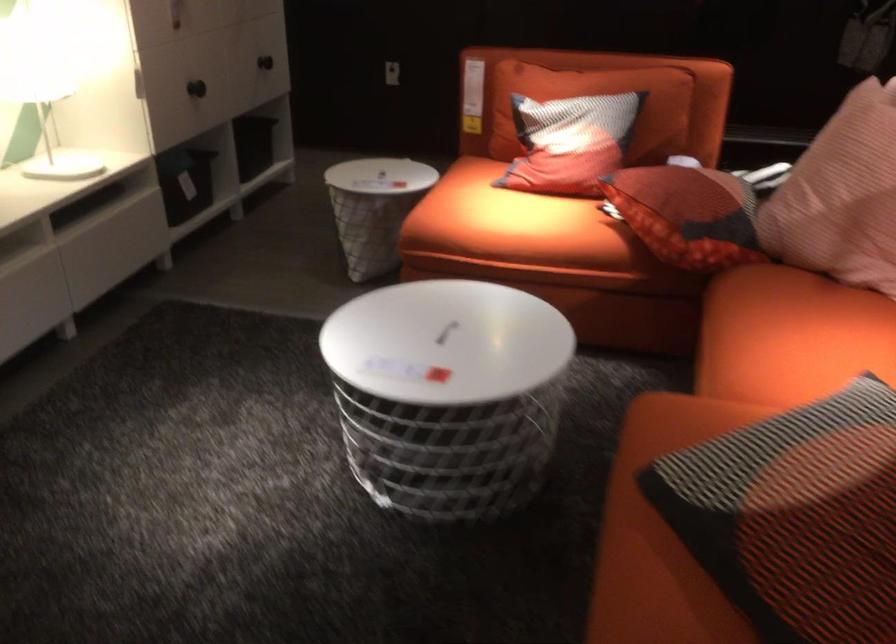
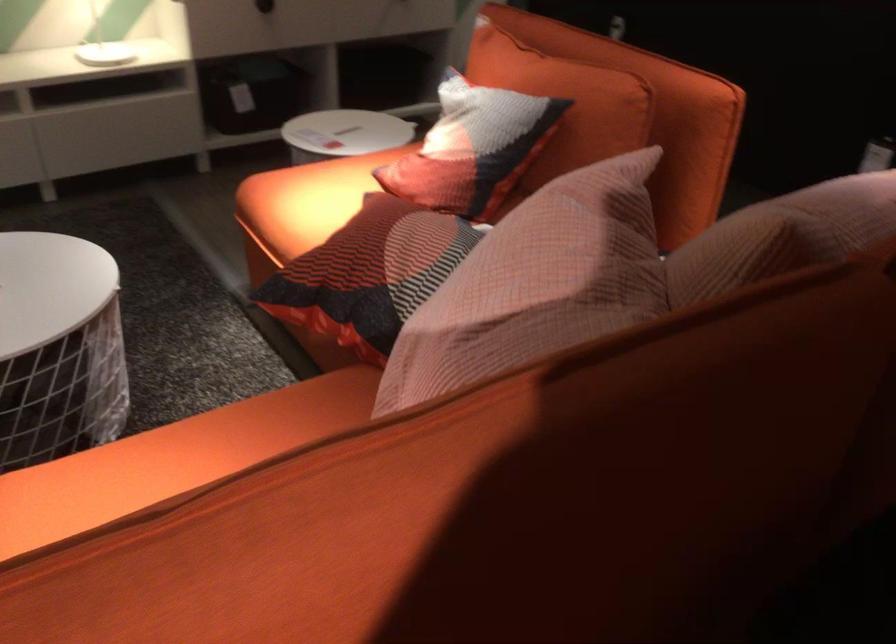
Find the pixel in the second image that matches point 211,96 in the first image.

(264, 6)